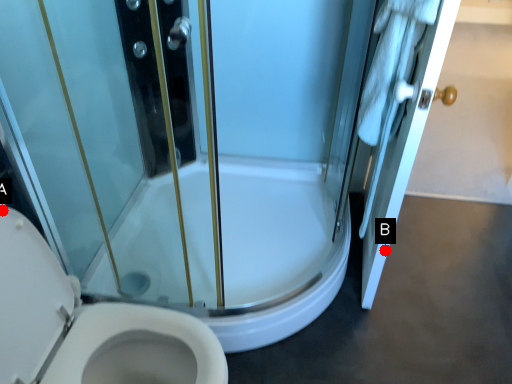
Question: Two points are circled on the image, labeled by A and B beside each circle. Which point is closer to the camera taking this photo?

Choices:
 (A) A is closer
 (B) B is closer

Answer: (A)